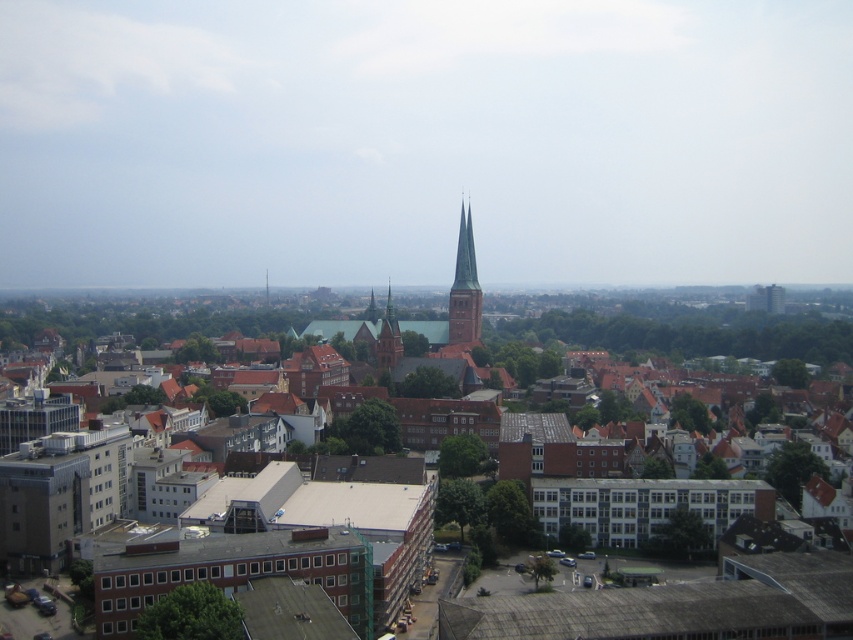
Question: Can you confirm if brown brick town at center is bigger than brown stone tower at center?

Choices:
 (A) no
 (B) yes

Answer: (B)

Question: Which of the following is the closest to the observer?

Choices:
 (A) brown stone tower at center
 (B) brown brick town at center

Answer: (B)

Question: Among these objects, which one is nearest to the camera?

Choices:
 (A) brown brick town at center
 (B) brown stone tower at center

Answer: (A)

Question: From the image, what is the correct spatial relationship of brown brick town at center in relation to brown stone tower at center?

Choices:
 (A) left
 (B) right

Answer: (B)

Question: Can you confirm if brown brick town at center is wider than brown stone tower at center?

Choices:
 (A) yes
 (B) no

Answer: (A)

Question: Which point is farther to the camera?

Choices:
 (A) (460, 346)
 (B) (451, 330)

Answer: (B)